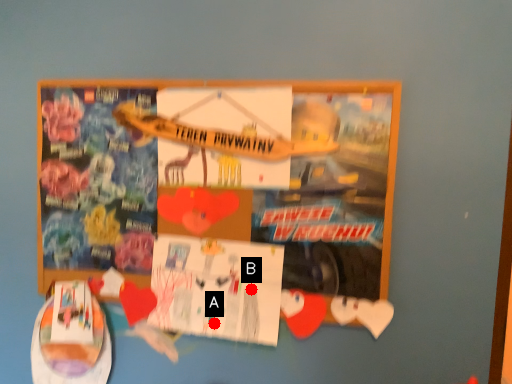
Question: Two points are circled on the image, labeled by A and B beside each circle. Which point is closer to the camera taking this photo?

Choices:
 (A) A is closer
 (B) B is closer

Answer: (B)